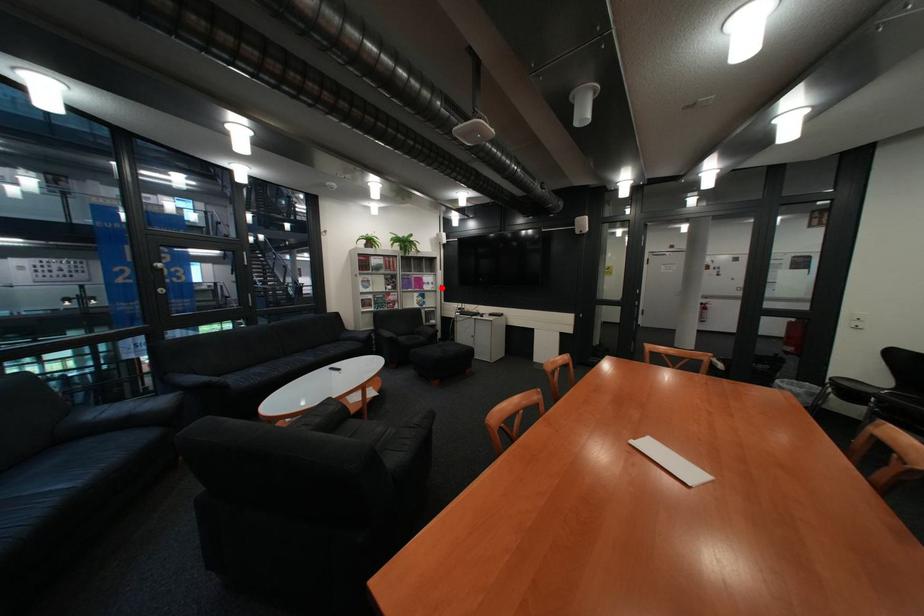
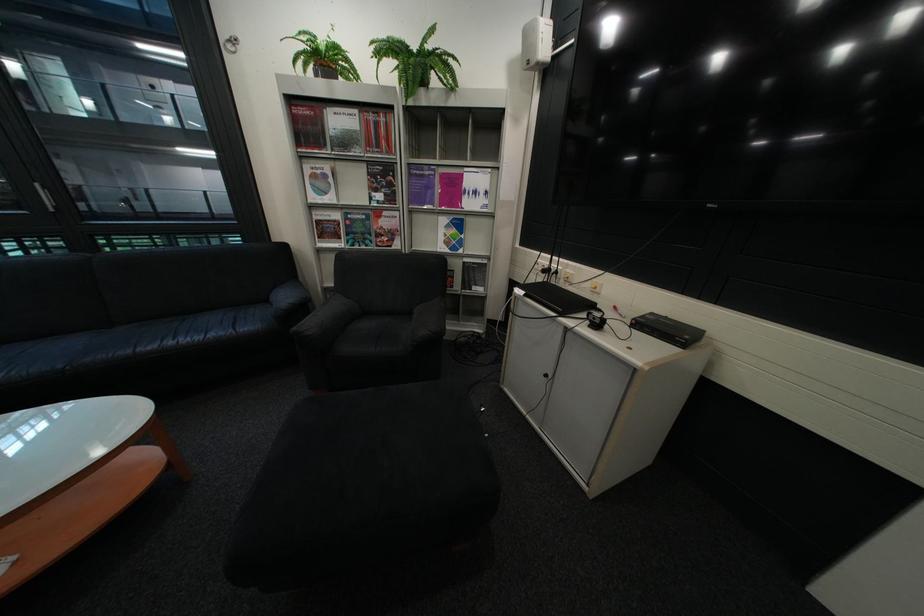
In the second image, find the point that corresponds to the highlighted location in the first image.

(484, 204)